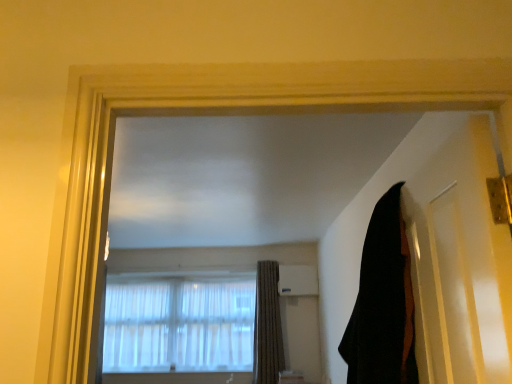
Question: In the image, is black fabric curtain at right, which ranks as the 2th curtain in bottom-to-top order, on the left side or the right side of black matte door at right?

Choices:
 (A) right
 (B) left

Answer: (B)

Question: Would you say black fabric curtain at right, arranged as the first curtain when viewed from the top, is inside or outside black matte door at right?

Choices:
 (A) outside
 (B) inside

Answer: (A)

Question: Which object is the farthest from the beige textured curtain at center, acting as the 2th curtain starting from the front?

Choices:
 (A) black matte door at right
 (B) black fabric curtain at right, which is the first curtain from front to back
 (C) translucent fabric at center

Answer: (A)

Question: Estimate the real-world distances between objects in this image. Which object is closer to the black fabric curtain at right, the first curtain viewed from the right?

Choices:
 (A) beige textured curtain at center, the first curtain in the back-to-front sequence
 (B) black matte door at right
 (C) translucent fabric at center

Answer: (B)